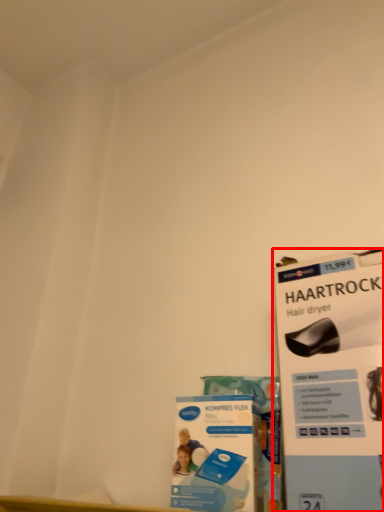
Question: Observing the image, what is the correct spatial positioning of magazine (annotated by the red box) in reference to flyer?

Choices:
 (A) left
 (B) right

Answer: (B)